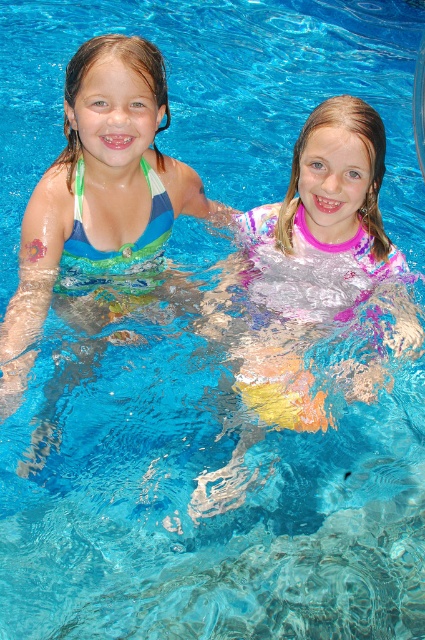
Question: Does multicolored fabric swimsuit at center lie in front of matte blue swimsuit at left?

Choices:
 (A) yes
 (B) no

Answer: (B)

Question: Does multicolored fabric swimsuit at center appear over matte blue swimsuit at left?

Choices:
 (A) no
 (B) yes

Answer: (A)

Question: Which object is farther from the camera taking this photo?

Choices:
 (A) matte blue swimsuit at left
 (B) multicolored fabric swimsuit at center

Answer: (B)

Question: Does multicolored fabric swimsuit at center lie in front of matte blue swimsuit at left?

Choices:
 (A) yes
 (B) no

Answer: (B)